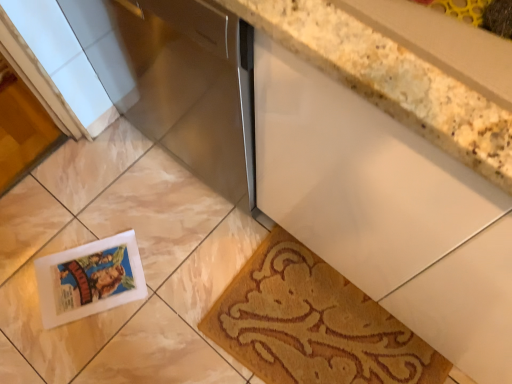
Locate an element on the screen. This screenshot has width=512, height=384. vacant region to the right of white glossy postcard at lower left is located at coordinates (169, 270).